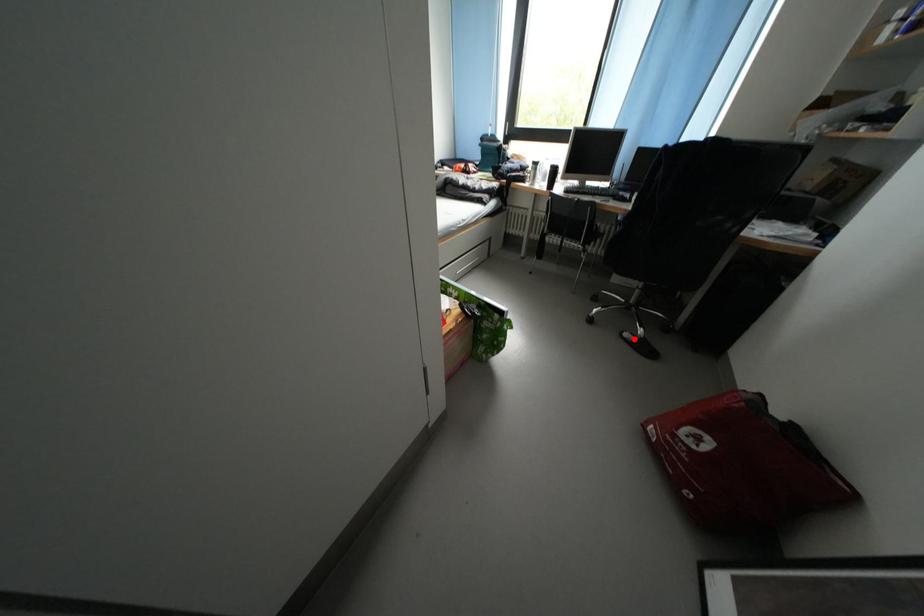
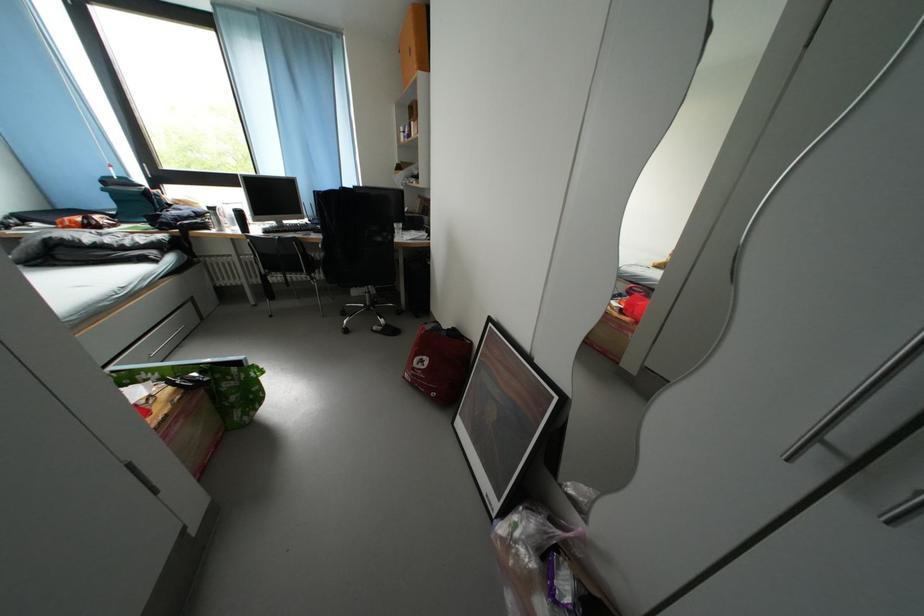
Where in the second image is the point corresponding to the highlighted location from the first image?

(383, 333)